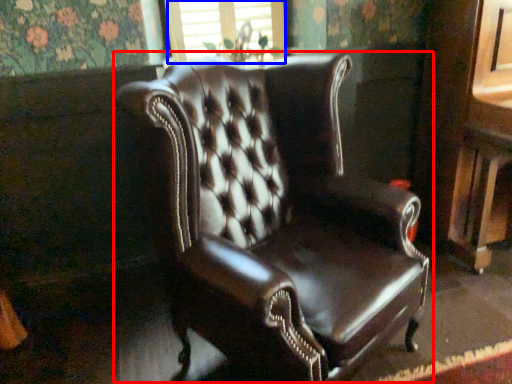
Question: Which point is further to the camera, chair (highlighted by a red box) or window frame (highlighted by a blue box)?

Choices:
 (A) chair
 (B) window frame

Answer: (B)